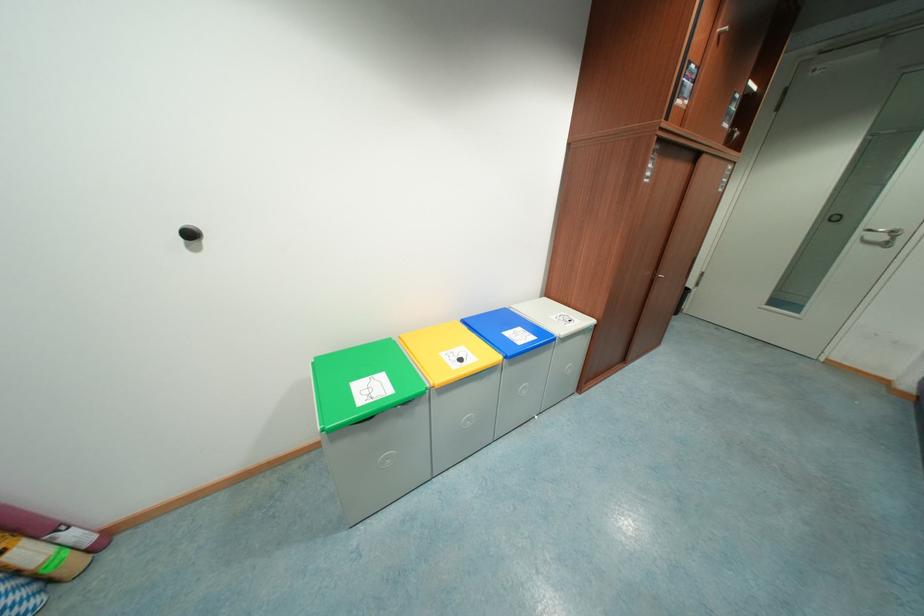
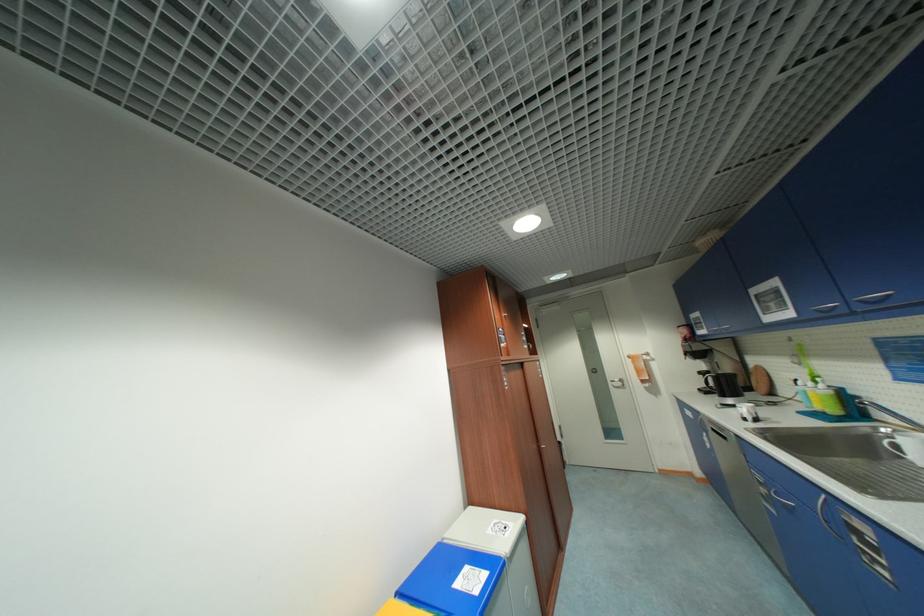
Locate, in the second image, the point that corresponds to [526,344] in the first image.

(482, 593)